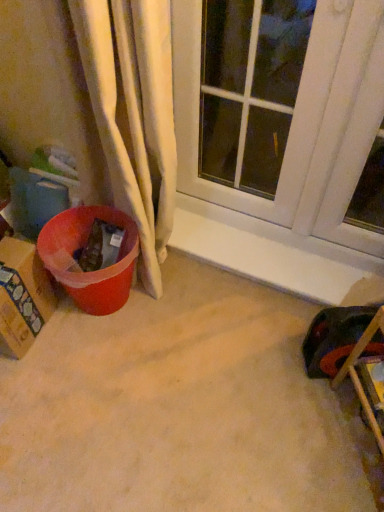
Image resolution: width=384 pixels, height=512 pixels. Identify the location of free spot above white smooth window sill at center (from a real-world perspective). (259, 257).